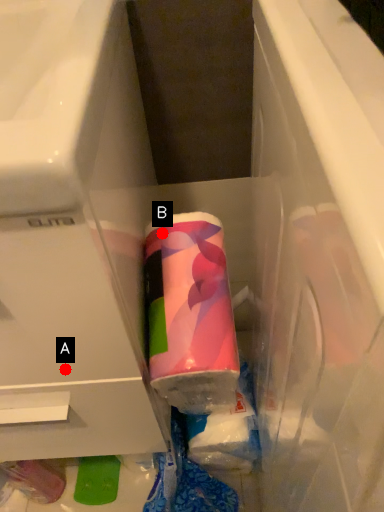
Question: Two points are circled on the image, labeled by A and B beside each circle. Which point is closer to the camera?

Choices:
 (A) A is closer
 (B) B is closer

Answer: (A)